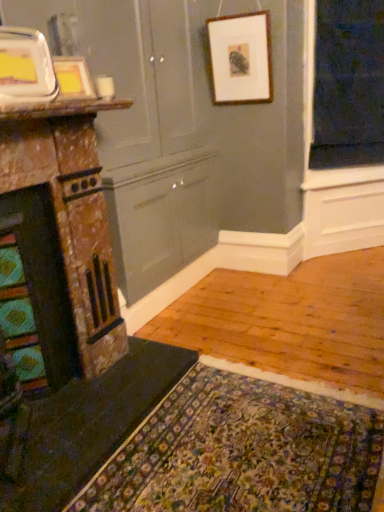
Image resolution: width=384 pixels, height=512 pixels. I want to click on free space above dark green felt doormat at lower left (from a real-world perspective), so click(x=235, y=446).